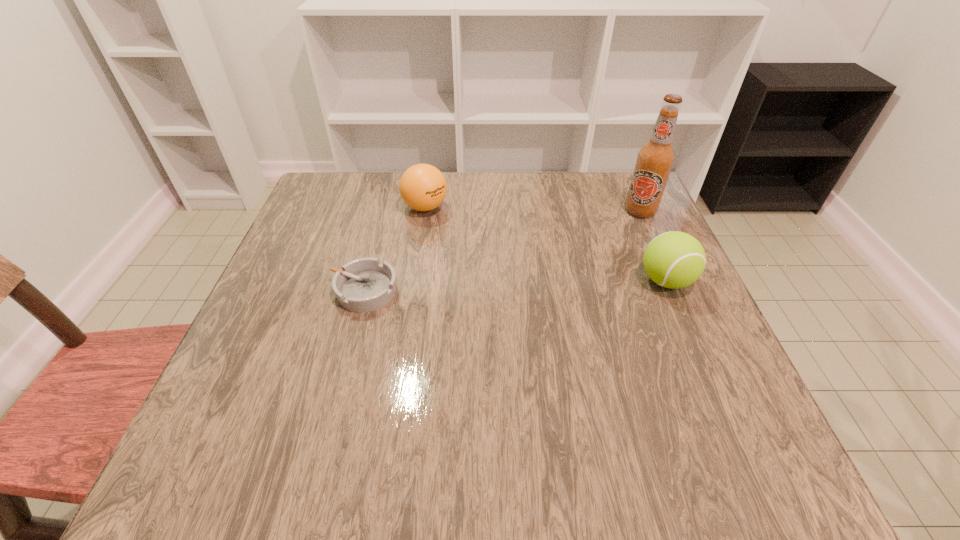
Identify the location of vacant space in between the ashtray and the tennis ball. (516, 286).

I want to click on free space between the ping-pong ball and the tennis ball, so click(x=545, y=244).

Locate which object ranks third in proximity to the shortest object. Please provide its 2D coordinates. Your answer should be formatted as a tuple, i.e. [(x, y)], where the tuple contains the x and y coordinates of a point satisfying the conditions above.

[(655, 159)]

I want to click on the closest object relative to the beer bottle, so click(674, 259).

Find the location of a particular element. The height and width of the screenshot is (540, 960). free space that satisfies the following two spatial constraints: 1. on the back side of the ping-pong ball; 2. on the left side of the ashtray is located at coordinates (386, 207).

Identify the location of free space that satisfies the following two spatial constraints: 1. on the back side of the ashtray; 2. on the right side of the ping-pong ball. The image size is (960, 540). (386, 207).